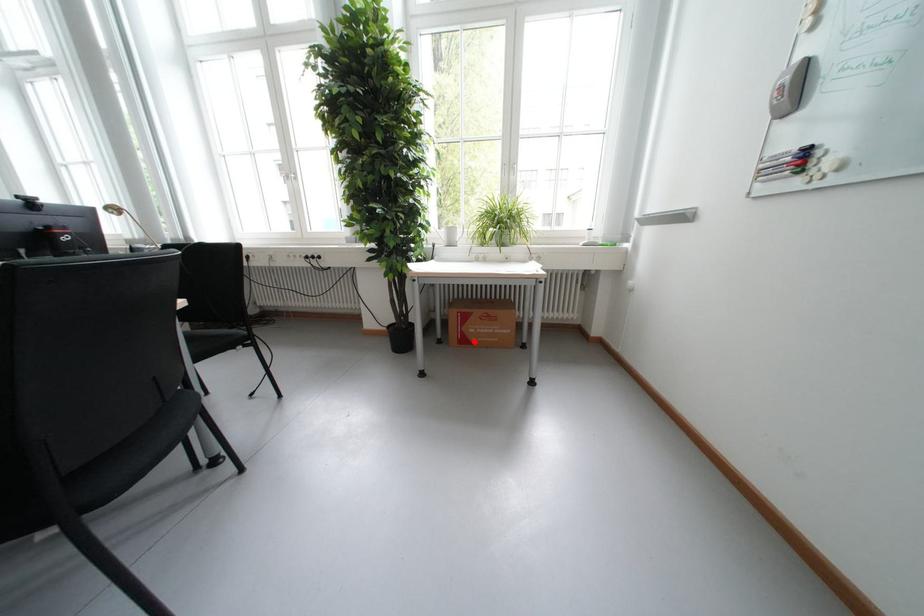
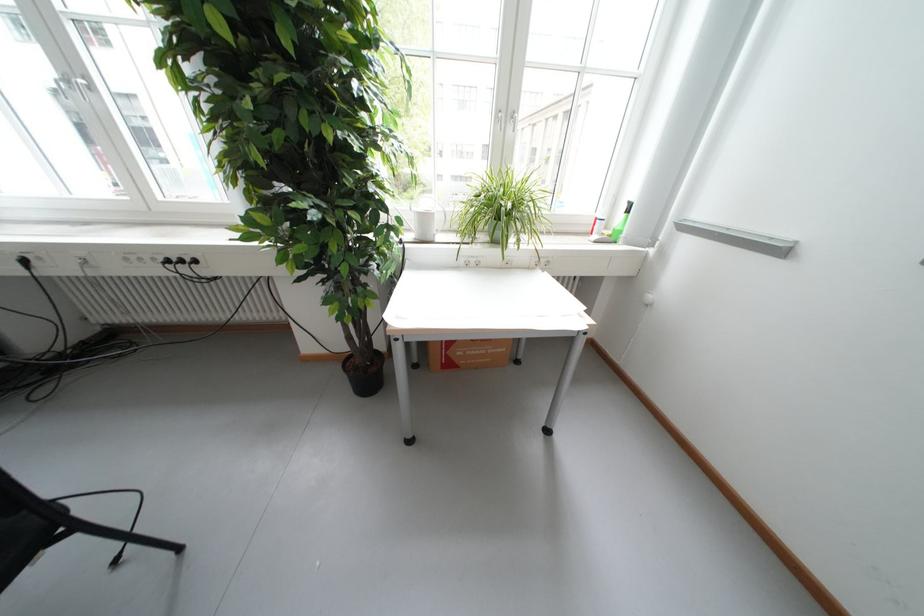
Locate, in the second image, the point that corresponds to the highlighted location in the first image.

(458, 366)